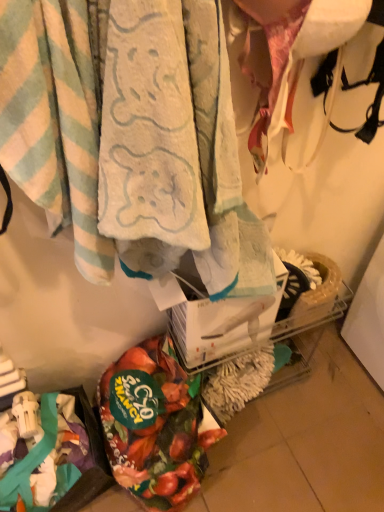
Question: From the image's perspective, is floral fabric bag at lower left positioned above or below soft cotton towel at center, which appears as the first towel when viewed from the right?

Choices:
 (A) below
 (B) above

Answer: (A)

Question: From a real-world perspective, is floral fabric bag at lower left positioned above or below soft cotton towel at center, which ranks as the 2th towel in left-to-right order?

Choices:
 (A) below
 (B) above

Answer: (A)

Question: Considering the real-world distances, which object is closest to the floral fabric bag at lower left?

Choices:
 (A) light blue striped towel at upper left, marked as the 1th towel in a left-to-right arrangement
 (B) soft cotton towel at center, which appears as the first towel when viewed from the right

Answer: (B)

Question: Estimate the real-world distances between objects in this image. Which object is farther from the floral fabric bag at lower left?

Choices:
 (A) soft cotton towel at center, which ranks as the 2th towel in left-to-right order
 (B) light blue striped towel at upper left, arranged as the second towel when viewed from the right

Answer: (B)